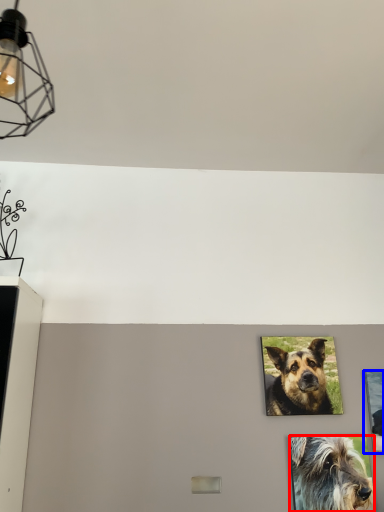
Question: Which of the following is the closest to the observer, dog (highlighted by a red box) or picture frame (highlighted by a blue box)?

Choices:
 (A) dog
 (B) picture frame

Answer: (A)